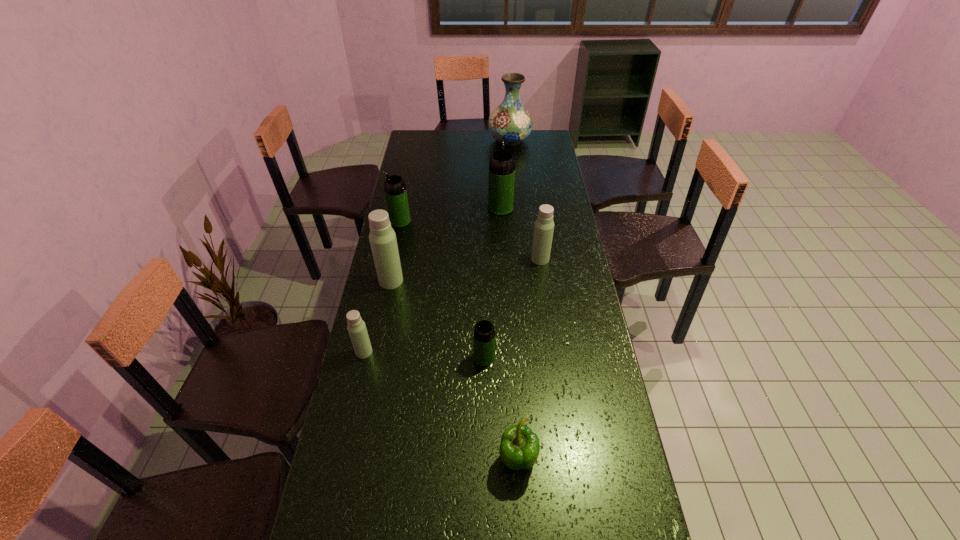
Identify the location of vacant space that satisfies the following two spatial constraints: 1. from the spout of the bell pepper; 2. on the left side of the leftmost green thermos bottle. (350, 460).

Where is `free space that satisfies the following two spatial constraints: 1. on the front side of the smallest light thermos bottle; 2. on the right side of the green bell pepper`? The width and height of the screenshot is (960, 540). free space that satisfies the following two spatial constraints: 1. on the front side of the smallest light thermos bottle; 2. on the right side of the green bell pepper is located at coordinates (340, 460).

Find the location of `blank area in the image that satisfies the following two spatial constraints: 1. on the front side of the second farthest light thermos bottle; 2. on the left side of the bell pepper`. blank area in the image that satisfies the following two spatial constraints: 1. on the front side of the second farthest light thermos bottle; 2. on the left side of the bell pepper is located at coordinates (355, 460).